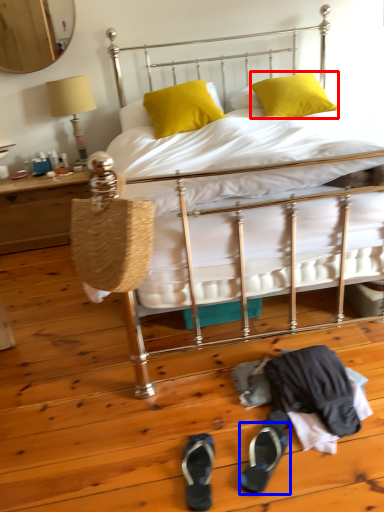
Question: Which point is further to the camera, pillow (highlighted by a red box) or footwear (highlighted by a blue box)?

Choices:
 (A) pillow
 (B) footwear

Answer: (A)